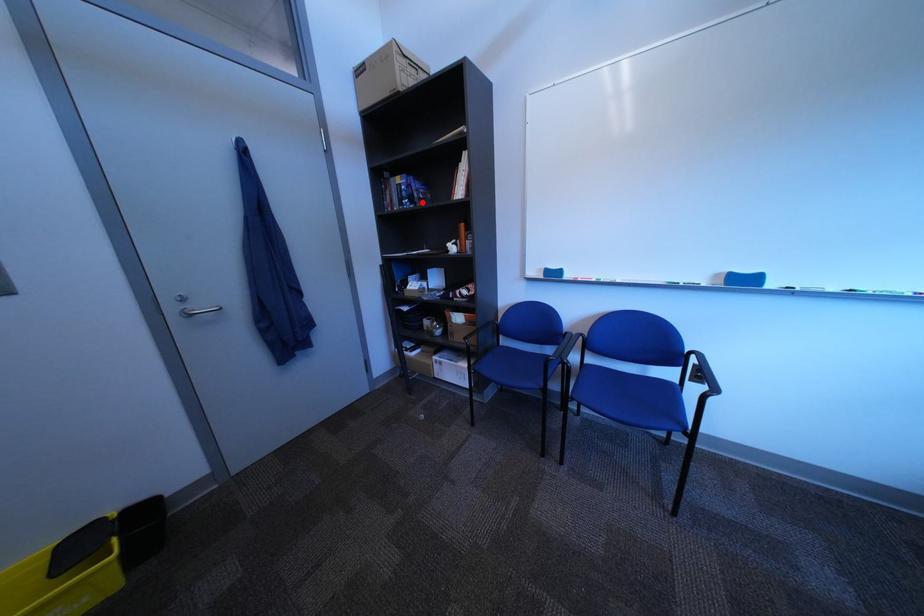
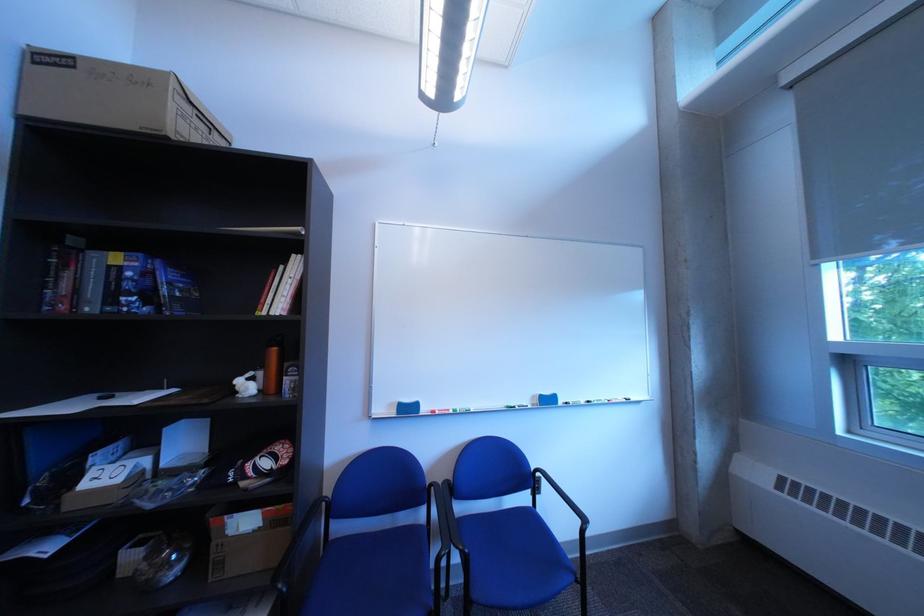
The point at the highlighted location is marked in the first image. Where is the corresponding point in the second image?

(150, 300)